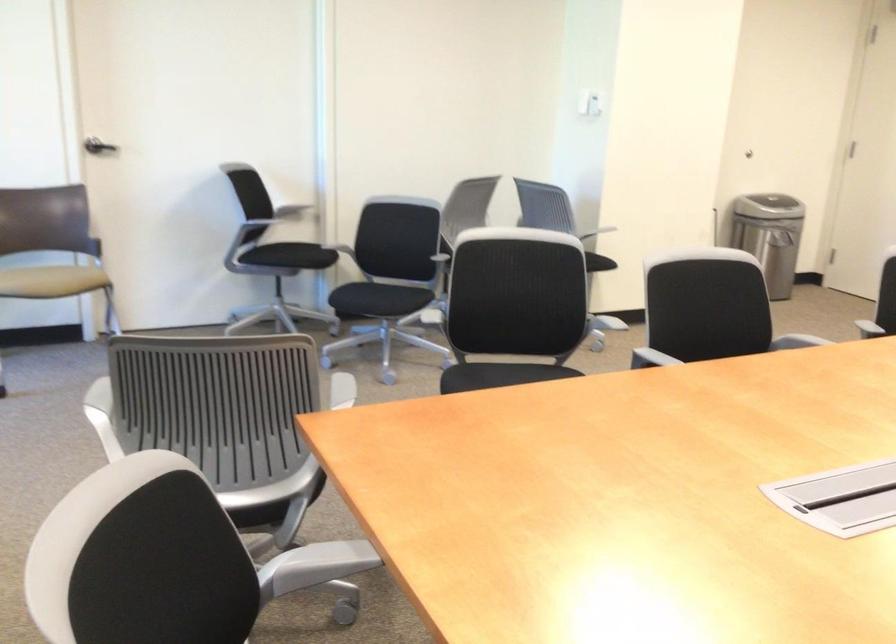
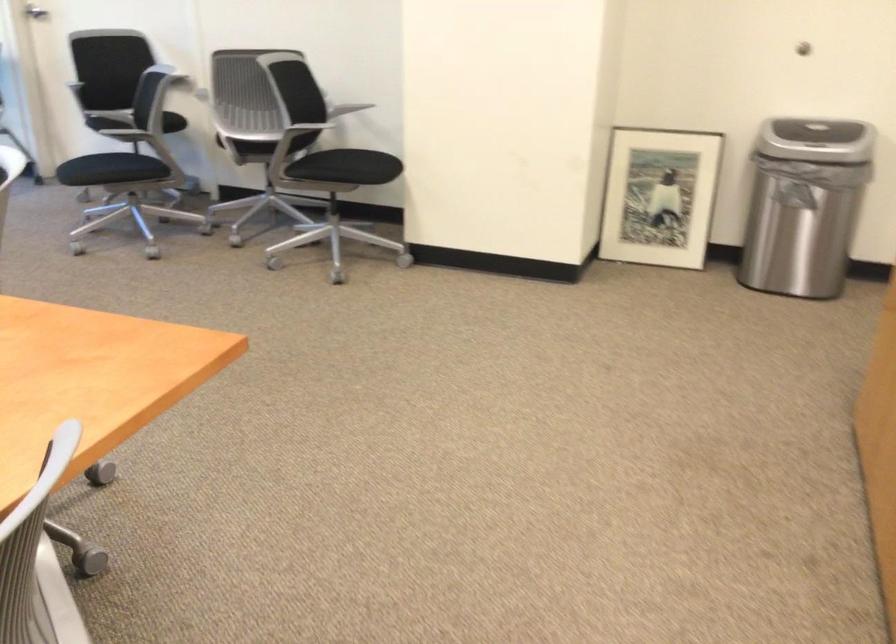
Find the pixel in the second image that matches point (400, 314) in the first image.

(112, 171)